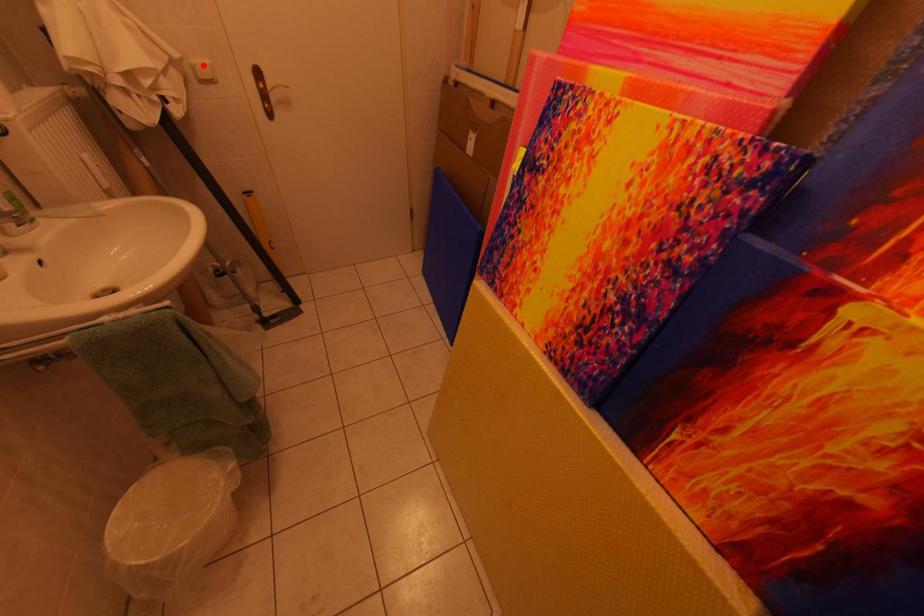
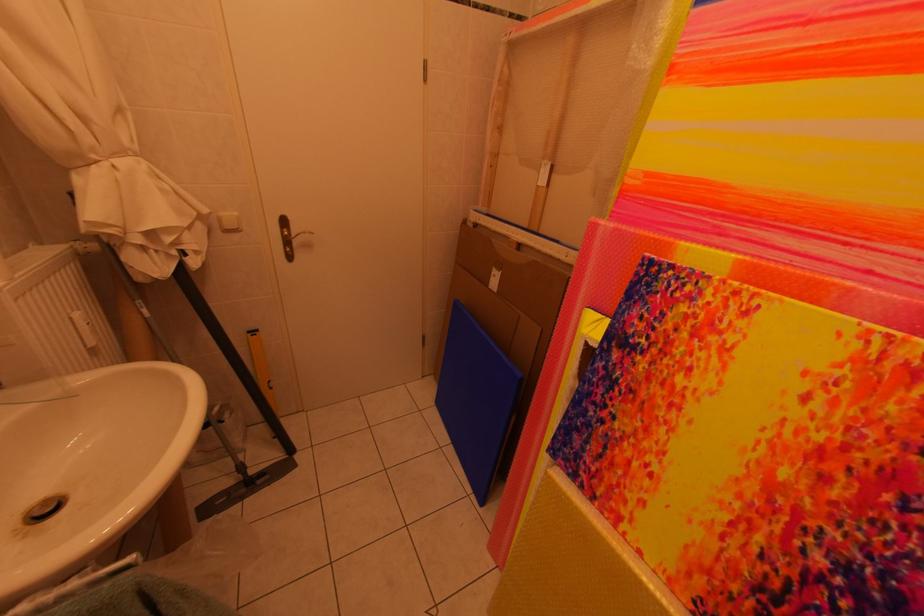
The point at the highlighted location is marked in the first image. Where is the corresponding point in the second image?

(229, 217)